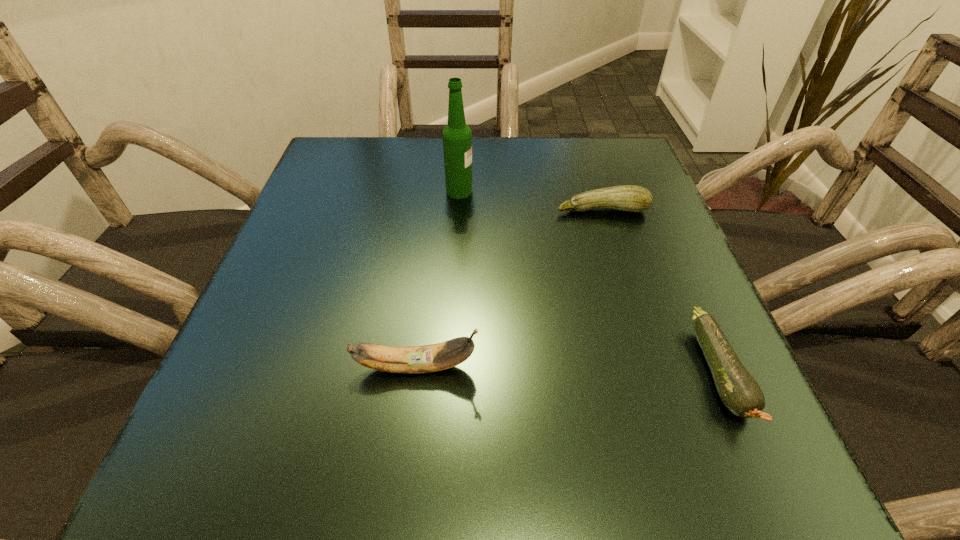
Find the location of a particular element. The width and height of the screenshot is (960, 540). beer bottle is located at coordinates (x=457, y=137).

At what (x,y) coordinates should I click in order to perform the action: click on the farthest object. Please return your answer as a coordinate pair (x, y). The width and height of the screenshot is (960, 540). Looking at the image, I should click on (457, 137).

You are a GUI agent. You are given a task and a screenshot of the screen. Output one action in this format:
    pyautogui.click(x=<x>, y=<y>)
    Task: Click on the second tallest object
    
    Given the screenshot: What is the action you would take?
    pyautogui.click(x=429, y=358)

This screenshot has height=540, width=960. Find the location of `the farther zucchini`. the farther zucchini is located at coordinates (631, 198).

Locate an element on the screen. This screenshot has height=540, width=960. the nearer zucchini is located at coordinates (740, 393).

You are a GUI agent. You are given a task and a screenshot of the screen. Output one action in this format:
    pyautogui.click(x=<x>, y=<y>)
    Task: Click on the free space located 0.200m on the label of the farthest object
    This screenshot has width=960, height=540.
    Given the screenshot: What is the action you would take?
    pyautogui.click(x=568, y=191)

The height and width of the screenshot is (540, 960). Identify the location of blank space located on the peel of the banana. (683, 367).

This screenshot has height=540, width=960. In order to click on vacant space situated at the stem end of the third nearest object in this screenshot , I will do `click(641, 334)`.

The height and width of the screenshot is (540, 960). Identify the location of blank area located at the blossom end of the nearer zucchini. (769, 485).

Find the location of a particular element. This screenshot has width=960, height=540. object present at the far edge is located at coordinates (457, 137).